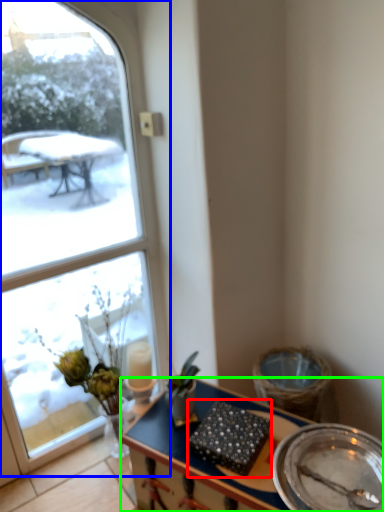
Question: Based on their relative distances, which object is farther from food (highlighted by a red box)? Choose from window (highlighted by a blue box) and desk (highlighted by a green box).

Choices:
 (A) window
 (B) desk

Answer: (A)